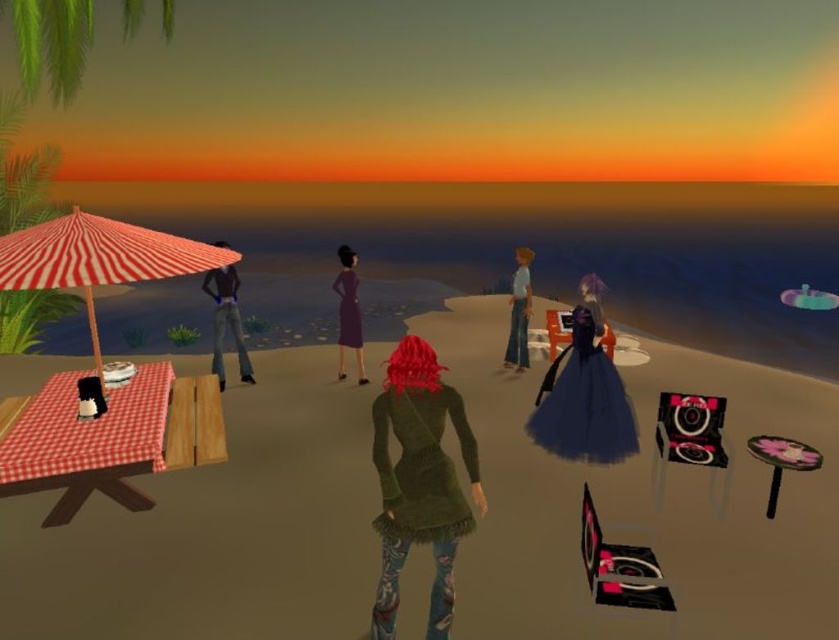
You are standing at the camera position and want to place a 3m wide banner between the wooden picnic table at left and the camera. Is there enough space?

The wooden picnic table at left and camera are 8.02 meters apart, so yes, the banner can be placed between them since the distance is greater than the banner width.

You are standing at the center of the beach facing the ocean. You want to move to the wooden picnic table at left. Which direction should you walk?

Since the wooden picnic table at left is located at point (644, 502), you should walk to your left to reach it.

You are a photographer setting up for a sunset photoshoot on the beach. You have a dark blue tulle dress at center and a pink fabric stool at lower right. Which object takes up more horizontal space in the image?

The dark blue tulle dress at center might be wider than pink fabric stool at lower right, so it likely takes up more horizontal space in the image.